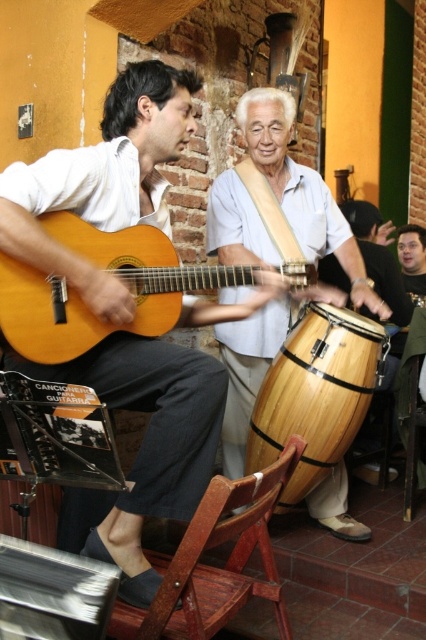
Based on the photo, you are a photographer setting up for a live music session. You need to position your camera so that both the natural wood drum at center and the wooden drum at center are in frame. Which drum should you focus on first if you want to capture the one closer to the ground?

The natural wood drum at center is below wooden drum at center, so you should focus on the natural wood drum at center first as it is closer to the ground.

You are a musician who wants to place both the matte wood guitar at left and the natural wood drum at center on a shelf that can only hold items up to 1 meter in total width. Given their widths, can both items fit together on the shelf?

The matte wood guitar at left has a lesser width compared to natural wood drum at center. However, since their exact widths are not provided, we cannot determine if their combined width exceeds 1 meter. Please provide the specific measurements for accurate assessment.

Based on the photo, you are a photographer setting up for a live music session. You have a matte wood guitar at left and a wooden drum at center in your frame. Which object should you adjust your camera angle to focus on first if you want to capture the tallest object in the scene?

The matte wood guitar at left is much taller than the wooden drum at center, so you should focus on the matte wood guitar at left first.